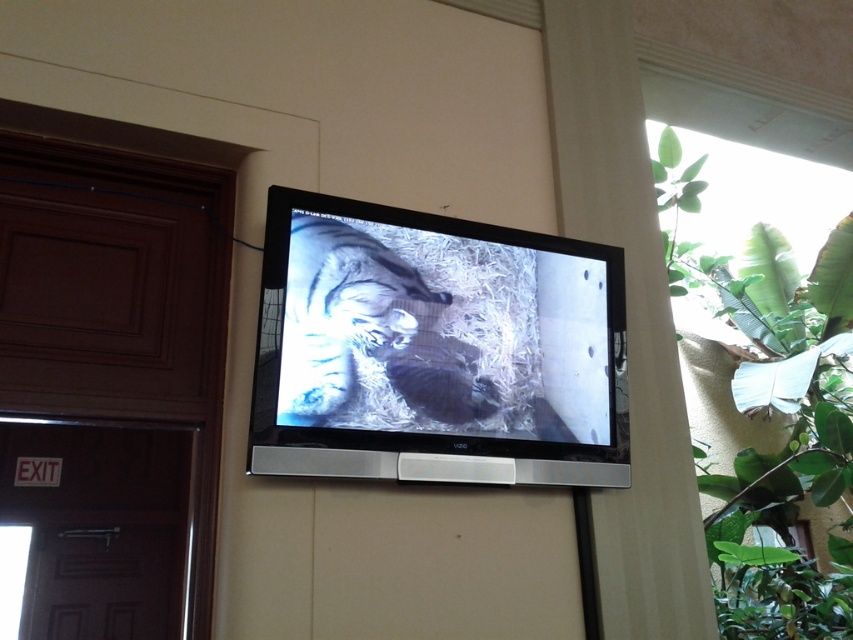
Is matte black tv at center positioned in front of green leafy plant at upper right?

Yes, it is in front of green leafy plant at upper right.

This screenshot has height=640, width=853. In order to click on matte black tv at center in this screenshot , I will do `click(440, 333)`.